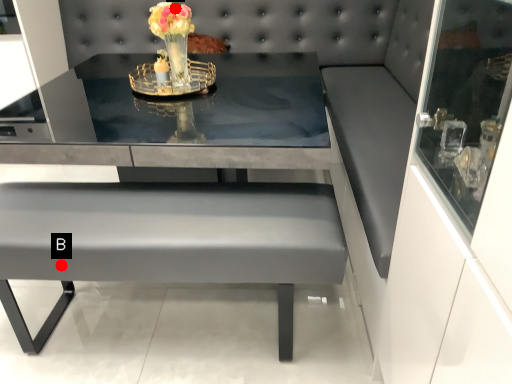
Question: Two points are circled on the image, labeled by A and B beside each circle. Which point is further to the camera?

Choices:
 (A) A is further
 (B) B is further

Answer: (A)